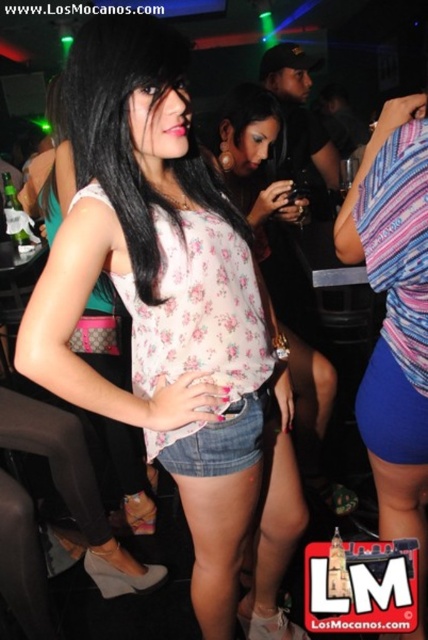
Is point (244, 269) in front of point (8, 218)?

Yes, it is in front of point (8, 218).

Does floral fabric top at center appear on the left side of clear glass bottle at center?

In fact, floral fabric top at center is to the right of clear glass bottle at center.

Who is more forward, [127,140] or [12,198]?

Point [127,140] is in front.

Identify the location of floral fabric top at center. This screenshot has height=640, width=428. (171, 316).

Is floral fabric blouse at center smaller than clear glass bottle at center?

Incorrect, floral fabric blouse at center is not smaller in size than clear glass bottle at center.

Where is `floral fabric blouse at center`? This screenshot has width=428, height=640. floral fabric blouse at center is located at coordinates (121, 122).

Which is behind, point (172, 163) or point (8, 216)?

Positioned behind is point (8, 216).

Where is `floral fabric blouse at center`? This screenshot has width=428, height=640. floral fabric blouse at center is located at coordinates (121, 122).

Is floral fabric top at center above floral fabric blouse at center?

Actually, floral fabric top at center is below floral fabric blouse at center.

You are a GUI agent. You are given a task and a screenshot of the screen. Output one action in this format:
    pyautogui.click(x=<x>, y=<y>)
    Task: Click on the floral fabric top at center
    The height and width of the screenshot is (640, 428).
    Given the screenshot: What is the action you would take?
    pyautogui.click(x=171, y=316)

Locate an element on the screen. The height and width of the screenshot is (640, 428). floral fabric top at center is located at coordinates (171, 316).